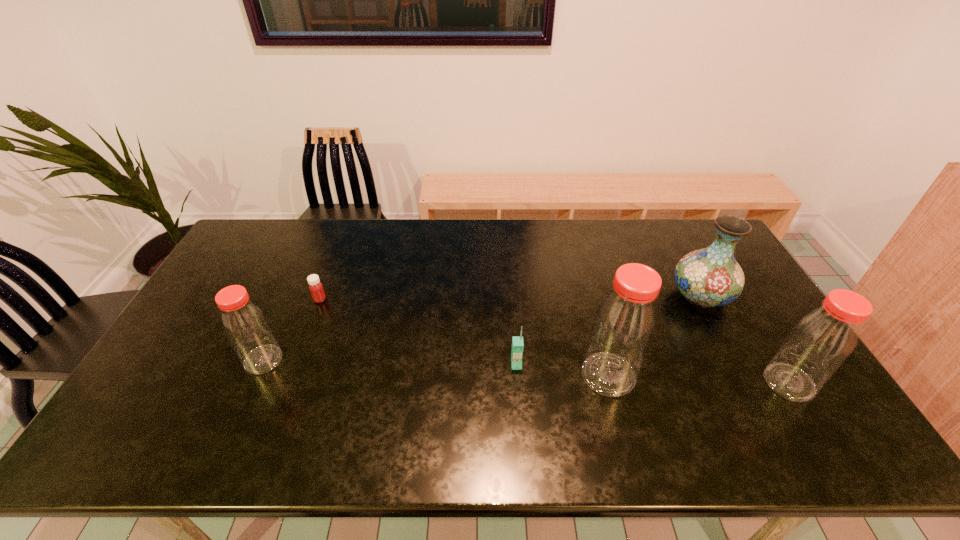
Where is `vacant space that is in between the second shortest bottle and the third object from left to right`? vacant space that is in between the second shortest bottle and the third object from left to right is located at coordinates (653, 373).

At what (x,y) coordinates should I click in order to perform the action: click on empty space that is in between the shortest bottle and the fourth object from right to left. Please return your answer as a coordinate pair (x, y). The image size is (960, 540). Looking at the image, I should click on (390, 362).

The width and height of the screenshot is (960, 540). Identify the location of free point between the second bottle from left to right and the shortest object. (465, 337).

Locate an element on the screen. object that stands as the fifth closest to the vase is located at coordinates (245, 325).

Locate an element on the screen. This screenshot has height=540, width=960. object that is the fifth closest to the rightmost bottle is located at coordinates (245, 325).

Locate an element on the screen. bottle object that ranks as the second closest to the leftmost bottle is located at coordinates (822, 340).

Locate which bottle ranks in proximity to the leftmost bottle. Please provide its 2D coordinates. Your answer should be formatted as a tuple, i.e. [(x, y)], where the tuple contains the x and y coordinates of a point satisfying the conditions above.

[(624, 325)]

Where is `vacant space that satisfies the following two spatial constraints: 1. on the back side of the medicine; 2. on the left side of the leftmost bottle`? The height and width of the screenshot is (540, 960). vacant space that satisfies the following two spatial constraints: 1. on the back side of the medicine; 2. on the left side of the leftmost bottle is located at coordinates (291, 299).

Locate an element on the screen. vacant region that satisfies the following two spatial constraints: 1. on the front side of the second bottle from right to left; 2. on the right side of the second object from left to right is located at coordinates (291, 375).